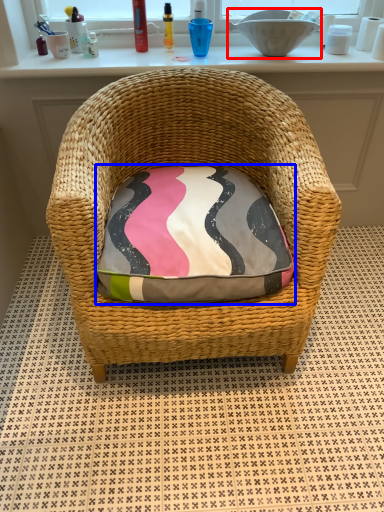
Question: Among these objects, which one is nearest to the camera, sink (highlighted by a red box) or throw pillow (highlighted by a blue box)?

Choices:
 (A) sink
 (B) throw pillow

Answer: (B)